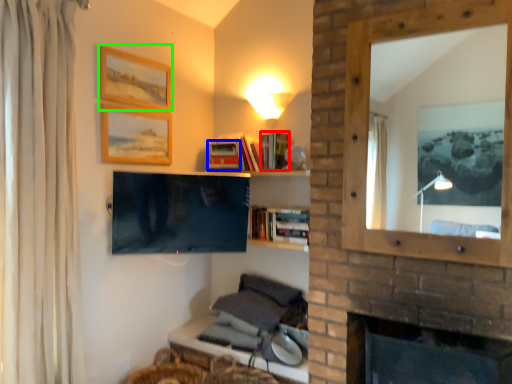
Question: Based on their relative distances, which object is nearer to book (highlighted by a red box)? Choose from book (highlighted by a blue box) and picture frame (highlighted by a green box).

Choices:
 (A) book
 (B) picture frame

Answer: (A)